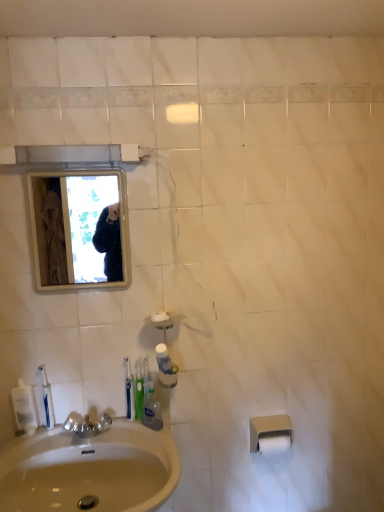
In order to click on free space in front of clear plastic mouthwash at lower left, marked as the first mouthwash in a left-to-right arrangement in this screenshot , I will do `click(19, 445)`.